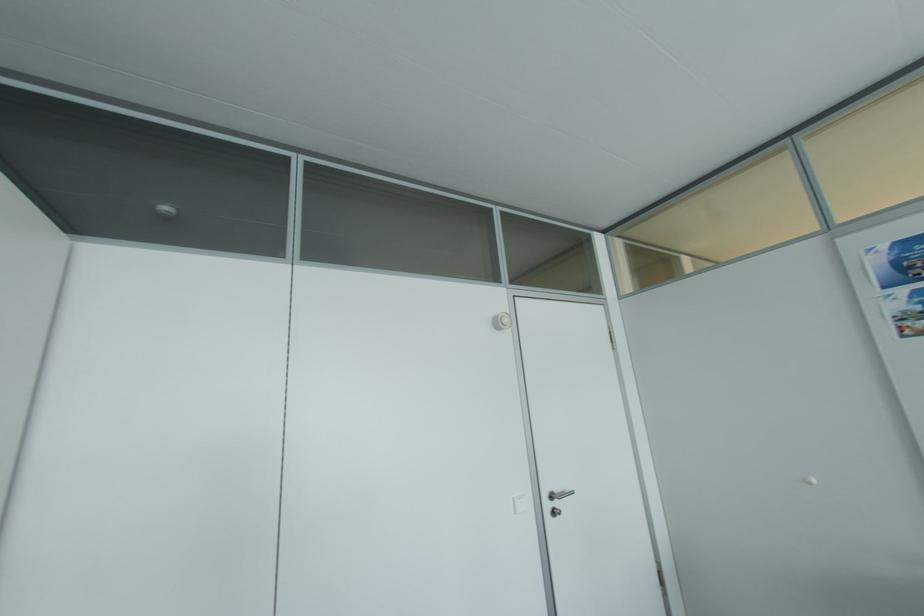
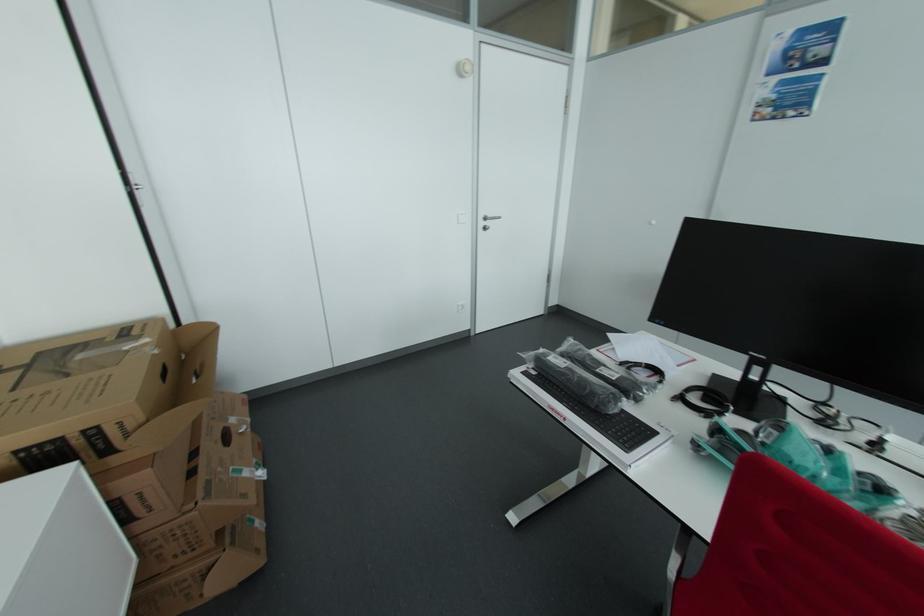
The point at [560,492] is marked in the first image. Where is the corresponding point in the second image?

(493, 216)